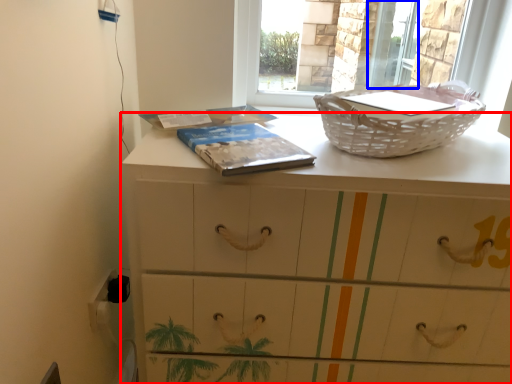
Question: Which object is further to the camera taking this photo, chest of drawers (highlighted by a red box) or screen door (highlighted by a blue box)?

Choices:
 (A) chest of drawers
 (B) screen door

Answer: (B)